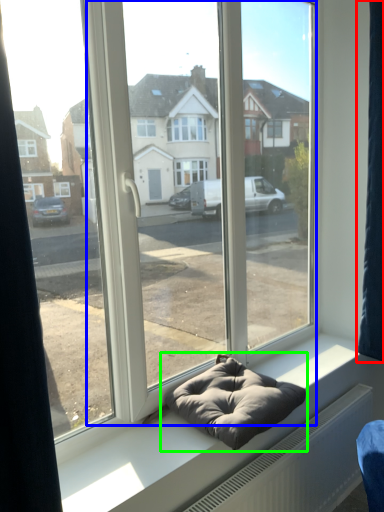
Question: Which object is the closest to the curtain (highlighted by a red box)? Choose among these: glass door (highlighted by a blue box) or bean bag chair (highlighted by a green box).

Choices:
 (A) glass door
 (B) bean bag chair

Answer: (A)